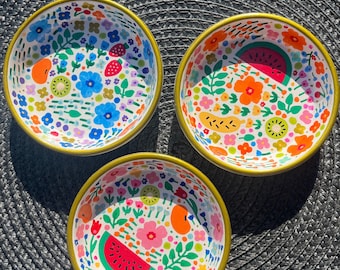
Locate an element on the screen. This screenshot has width=340, height=270. bowl on the left is located at coordinates (82, 72).